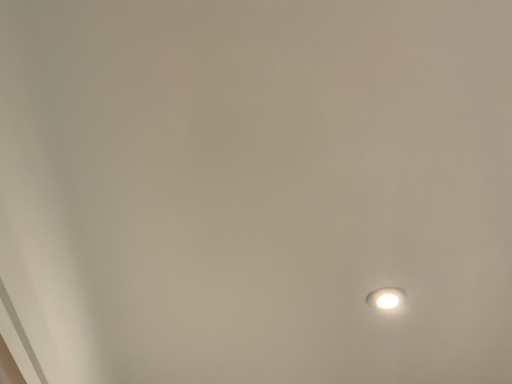
What do you see at coordinates (385, 298) in the screenshot? I see `white glossy lamp at upper right` at bounding box center [385, 298].

Find the location of a particular element. white glossy lamp at upper right is located at coordinates (385, 298).

What is the approximate height of white glossy lamp at upper right?

1.00 centimeters.

This screenshot has height=384, width=512. Find the location of `white glossy lamp at upper right`. white glossy lamp at upper right is located at coordinates (385, 298).